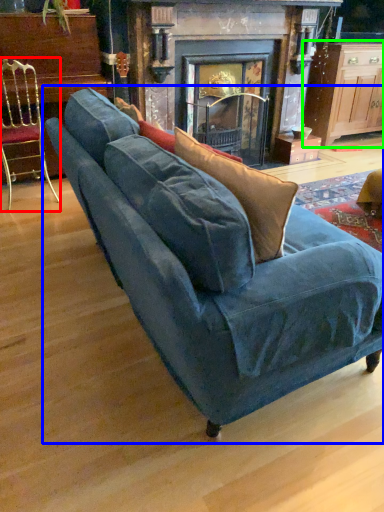
Question: Which object is the farthest from chair (highlighted by a red box)? Choose among these: studio couch (highlighted by a blue box) or table (highlighted by a green box).

Choices:
 (A) studio couch
 (B) table

Answer: (B)